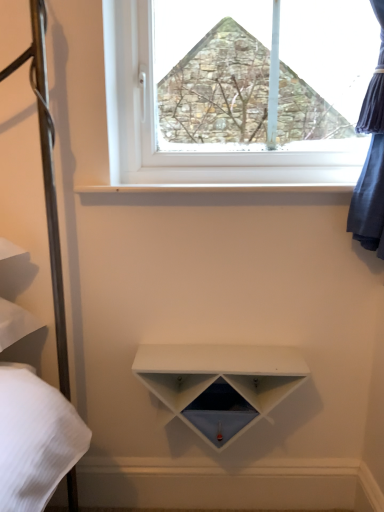
Image resolution: width=384 pixels, height=512 pixels. I want to click on empty space that is ontop of white matte shelf at center (from a real-world perspective), so click(226, 356).